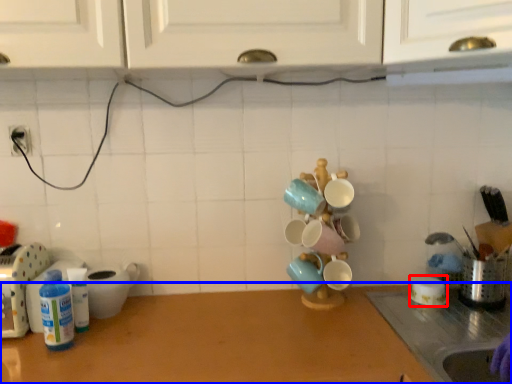
Question: Which of the following is the closest to the observer, tableware (highlighted by a red box) or countertop (highlighted by a blue box)?

Choices:
 (A) tableware
 (B) countertop

Answer: (B)